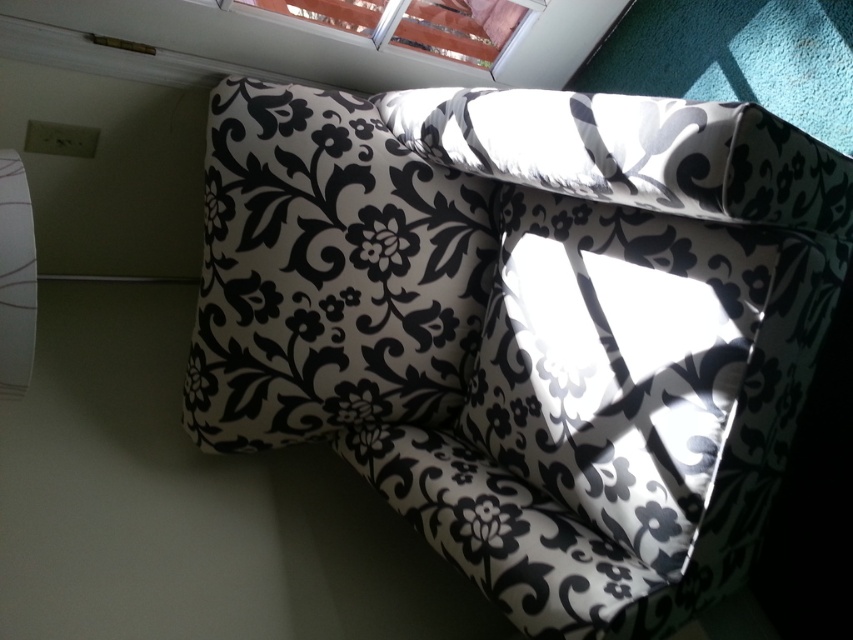
You are trying to decide whether to place a new throw blanket on the black floral fabric couch at center or the black floral cushion at center. Based on their sizes, which one do you think the throw blanket would fit better on?

The black floral fabric couch at center is larger in size than the black floral cushion at center, so the throw blanket would fit better on the black floral fabric couch at center.

You are sitting on the floor in the corner of the room and want to reach the black floral cushion at center. Can you grab it without moving your body?

The black floral cushion at center is 3.37 feet away from you, so it is too far to reach without moving your body.